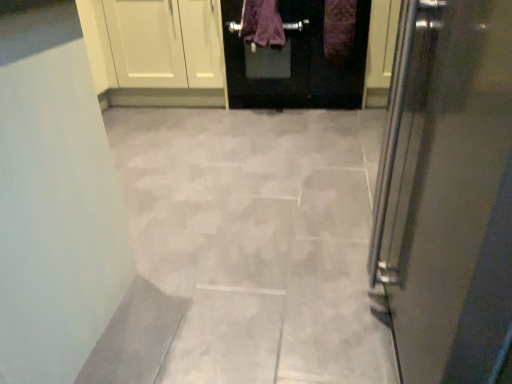
The height and width of the screenshot is (384, 512). In order to click on gray stone tile at center in this screenshot , I will do `click(258, 239)`.

This screenshot has width=512, height=384. Describe the element at coordinates (339, 30) in the screenshot. I see `purple fuzzy blanket at upper center, the 1th blanket positioned from the right` at that location.

I want to click on gray stone tile at center, so click(258, 239).

Identify the location of the 1st blanket behind the gray stone tile at center, starting your count from the anchor. (339, 30).

Is purple fuzzy blanket at upper center, the second blanket from the left, wider or thinner than gray stone tile at center?

Considering their sizes, purple fuzzy blanket at upper center, the second blanket from the left, looks slimmer than gray stone tile at center.

Considering the positions of objects purple fuzzy blanket at upper center, the 1th blanket positioned from the right, and gray stone tile at center in the image provided, who is more to the left, purple fuzzy blanket at upper center, the 1th blanket positioned from the right, or gray stone tile at center?

From the viewer's perspective, gray stone tile at center appears more on the left side.

Does gray stone tile at center have a greater height compared to purple fuzzy blanket at upper center, the second blanket from the left?

No.

Is point (352, 286) farther from viewer compared to point (335, 15)?

No, (352, 286) is closer to viewer.

Is gray stone tile at center in front of purple fuzzy blanket at upper center, the second blanket from the left?

Yes, it is in front of purple fuzzy blanket at upper center, the second blanket from the left.

What's the angular difference between gray stone tile at center and purple fabric at center, which is the first blanket in left-to-right order,'s facing directions?

The facing directions of gray stone tile at center and purple fabric at center, which is the first blanket in left-to-right order, are 1.4 degrees apart.

Would you say gray stone tile at center is inside or outside purple fabric at center, which is the first blanket in left-to-right order?

gray stone tile at center is spatially situated outside purple fabric at center, which is the first blanket in left-to-right order.

From a real-world perspective, is gray stone tile at center on purple fabric at center, which appears as the second blanket when viewed from the right?

No.

Which is more to the left, gray stone tile at center or purple fabric at center, which appears as the second blanket when viewed from the right?

gray stone tile at center is more to the left.

From a real-world perspective, which object rests below the other?

matte black door at upper center, from a real-world perspective.

Which point is more distant from viewer, (344, 61) or (368, 14)?

The point (344, 61) is farther.

Is purple fuzzy blanket at upper center, the 1th blanket positioned from the right, wider or thinner than matte black door at upper center?

purple fuzzy blanket at upper center, the 1th blanket positioned from the right, is thinner than matte black door at upper center.

From their relative heights in the image, would you say purple fuzzy blanket at upper center, the 1th blanket positioned from the right, is taller or shorter than matte black door at upper center?

purple fuzzy blanket at upper center, the 1th blanket positioned from the right, is shorter than matte black door at upper center.

There is a purple fuzzy blanket at upper center, the 1th blanket positioned from the right. At what (x,y) coordinates should I click in order to perform the action: click on blanket above it (from a real-world perspective). Please return your answer as a coordinate pair (x, y). Looking at the image, I should click on (262, 23).

Choose the correct answer: Is purple fabric at center, which appears as the second blanket when viewed from the right, inside purple fuzzy blanket at upper center, the 1th blanket positioned from the right, or outside it?

purple fabric at center, which appears as the second blanket when viewed from the right, cannot be found inside purple fuzzy blanket at upper center, the 1th blanket positioned from the right.

From the image's perspective, is purple fabric at center, which appears as the second blanket when viewed from the right, beneath purple fuzzy blanket at upper center, the second blanket from the left?

Incorrect, from the image's perspective, purple fabric at center, which appears as the second blanket when viewed from the right, is higher than purple fuzzy blanket at upper center, the second blanket from the left.

Does purple fabric at center, which appears as the second blanket when viewed from the right, have a larger size compared to purple fuzzy blanket at upper center, the second blanket from the left?

Indeed, purple fabric at center, which appears as the second blanket when viewed from the right, has a larger size compared to purple fuzzy blanket at upper center, the second blanket from the left.

Is there a large distance between matte black door at upper center and purple fabric at center, which appears as the second blanket when viewed from the right?

Actually, matte black door at upper center and purple fabric at center, which appears as the second blanket when viewed from the right, are a little close together.

Could you tell me if matte black door at upper center is facing purple fabric at center, which is the first blanket in left-to-right order?

Yes, matte black door at upper center is turned towards purple fabric at center, which is the first blanket in left-to-right order.

How many degrees apart are the facing directions of matte black door at upper center and purple fabric at center, which is the first blanket in left-to-right order?

There is a 0.526-degree angle between the facing directions of matte black door at upper center and purple fabric at center, which is the first blanket in left-to-right order.

In the image, is matte black door at upper center positioned in front of or behind purple fabric at center, which is the first blanket in left-to-right order?

matte black door at upper center is behind purple fabric at center, which is the first blanket in left-to-right order.

Is purple fabric at center, which appears as the second blanket when viewed from the right, taller than matte black door at upper center?

Incorrect, the height of purple fabric at center, which appears as the second blanket when viewed from the right, is not larger of that of matte black door at upper center.

From a real-world perspective, who is located higher, purple fabric at center, which is the first blanket in left-to-right order, or matte black door at upper center?

In real-world perspective, purple fabric at center, which is the first blanket in left-to-right order, is above.

How many degrees apart are the facing directions of purple fabric at center, which appears as the second blanket when viewed from the right, and matte black door at upper center?

There is a 0.526-degree angle between the facing directions of purple fabric at center, which appears as the second blanket when viewed from the right, and matte black door at upper center.

Does point (255, 17) come closer to viewer compared to point (348, 68)?

Yes, it is in front of point (348, 68).

Locate an element on the screen. ceramic tile below the purple fuzzy blanket at upper center, the 1th blanket positioned from the right (from the image's perspective) is located at coordinates (258, 239).

The width and height of the screenshot is (512, 384). Identify the location of ceramic tile in front of the purple fuzzy blanket at upper center, the 1th blanket positioned from the right. (258, 239).

When comparing their distances from gray stone tile at center, does purple fuzzy blanket at upper center, the 1th blanket positioned from the right, or purple fabric at center, which is the first blanket in left-to-right order, seem closer?

purple fuzzy blanket at upper center, the 1th blanket positioned from the right.

Looking at the image, which one is located further to gray stone tile at center, purple fabric at center, which is the first blanket in left-to-right order, or purple fuzzy blanket at upper center, the 1th blanket positioned from the right?

purple fabric at center, which is the first blanket in left-to-right order, lies further to gray stone tile at center than the other object.

When comparing their distances from gray stone tile at center, does purple fabric at center, which is the first blanket in left-to-right order, or matte black door at upper center seem further?

Based on the image, purple fabric at center, which is the first blanket in left-to-right order, appears to be further to gray stone tile at center.

Which object lies further to the anchor point gray stone tile at center, matte black door at upper center or purple fuzzy blanket at upper center, the 1th blanket positioned from the right?

purple fuzzy blanket at upper center, the 1th blanket positioned from the right, is positioned further to the anchor gray stone tile at center.

Considering their positions, is purple fabric at center, which appears as the second blanket when viewed from the right, positioned further to purple fuzzy blanket at upper center, the 1th blanket positioned from the right, than gray stone tile at center?

The object further to purple fuzzy blanket at upper center, the 1th blanket positioned from the right, is gray stone tile at center.

Estimate the real-world distances between objects in this image. Which object is closer to purple fabric at center, which is the first blanket in left-to-right order, purple fuzzy blanket at upper center, the second blanket from the left, or gray stone tile at center?

Among the two, purple fuzzy blanket at upper center, the second blanket from the left, is located nearer to purple fabric at center, which is the first blanket in left-to-right order.

Considering their positions, is gray stone tile at center positioned further to purple fabric at center, which appears as the second blanket when viewed from the right, than purple fuzzy blanket at upper center, the second blanket from the left?

Among the two, gray stone tile at center is located further to purple fabric at center, which appears as the second blanket when viewed from the right.

Based on their spatial positions, is gray stone tile at center or purple fuzzy blanket at upper center, the 1th blanket positioned from the right, closer to matte black door at upper center?

The object closer to matte black door at upper center is purple fuzzy blanket at upper center, the 1th blanket positioned from the right.

The height and width of the screenshot is (384, 512). Identify the location of blanket positioned between gray stone tile at center and purple fabric at center, which appears as the second blanket when viewed from the right, from near to far. (339, 30).

Identify the location of door between purple fabric at center, which is the first blanket in left-to-right order, and purple fuzzy blanket at upper center, the 1th blanket positioned from the right, from left to right. (294, 62).